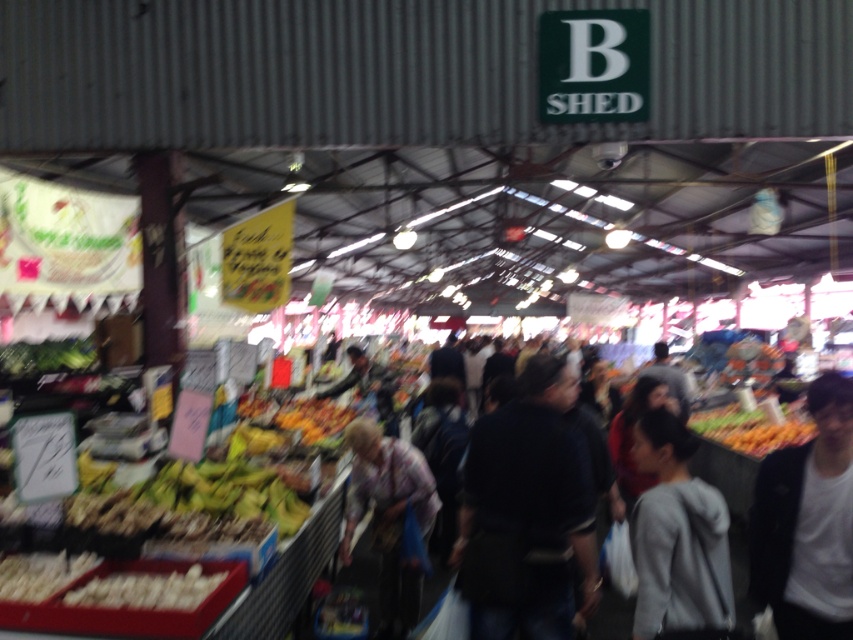
Is point (653, 417) positioned behind point (363, 484)?

No, it is not.

From the picture: Which is more to the left, gray hoodie at lower right or plaid shirt at center?

plaid shirt at center

In order to click on gray hoodie at lower right in this screenshot , I will do `click(677, 536)`.

Can you confirm if dark blue shirt at center is shorter than white matte jacket at lower right?

No, dark blue shirt at center is not shorter than white matte jacket at lower right.

Which is more to the left, dark blue shirt at center or white matte jacket at lower right?

dark blue shirt at center is more to the left.

Which is in front, point (585, 502) or point (837, 435)?

Point (837, 435) is more forward.

This screenshot has height=640, width=853. I want to click on dark blue shirt at center, so click(527, 513).

The width and height of the screenshot is (853, 640). Describe the element at coordinates (527, 513) in the screenshot. I see `dark blue shirt at center` at that location.

Is dark blue shirt at center bigger than gray hoodie at lower right?

Yes.

The width and height of the screenshot is (853, 640). Describe the element at coordinates (527, 513) in the screenshot. I see `dark blue shirt at center` at that location.

Image resolution: width=853 pixels, height=640 pixels. Find the location of `dark blue shirt at center`. dark blue shirt at center is located at coordinates (527, 513).